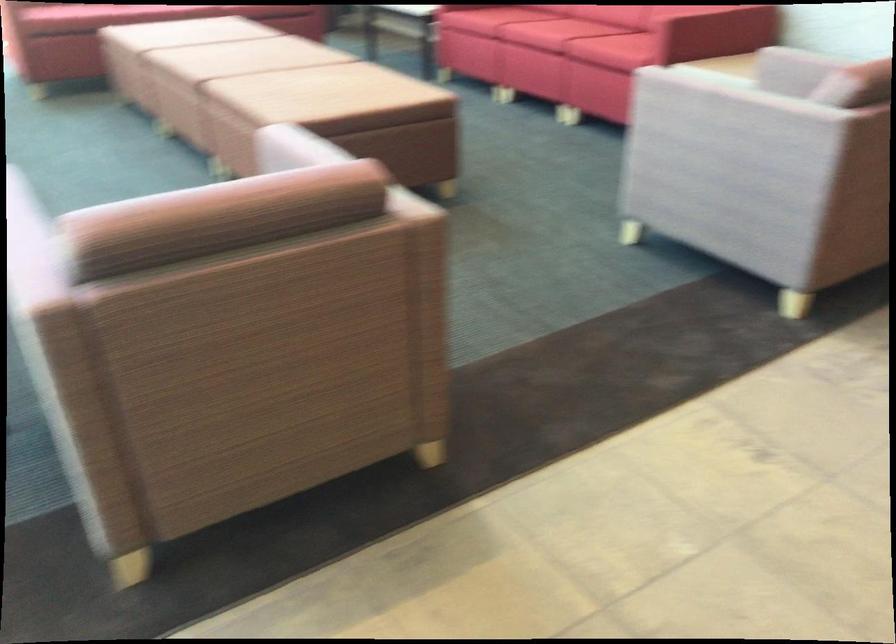
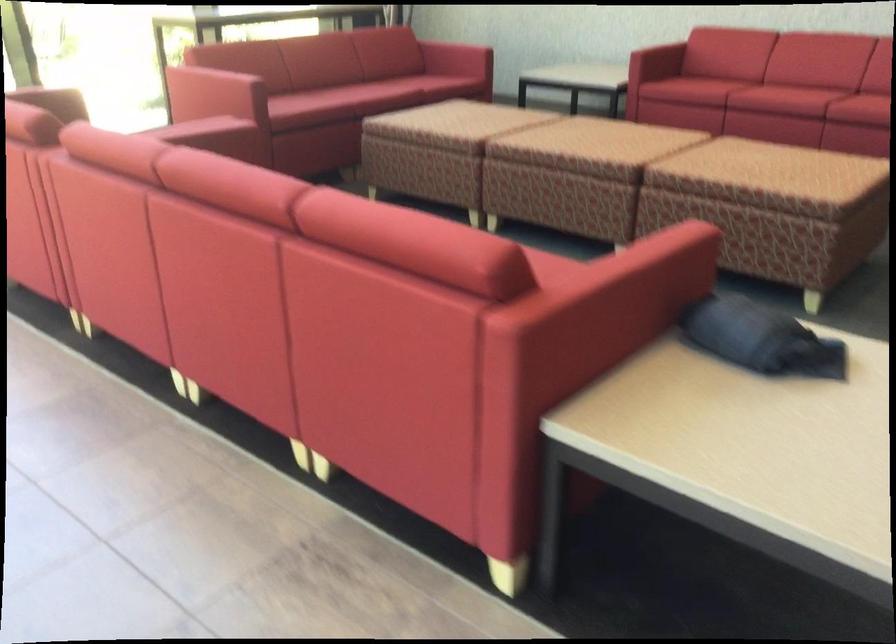
Based on the continuous images, in which direction is the camera rotating?

The rotation direction of the camera is right-down.